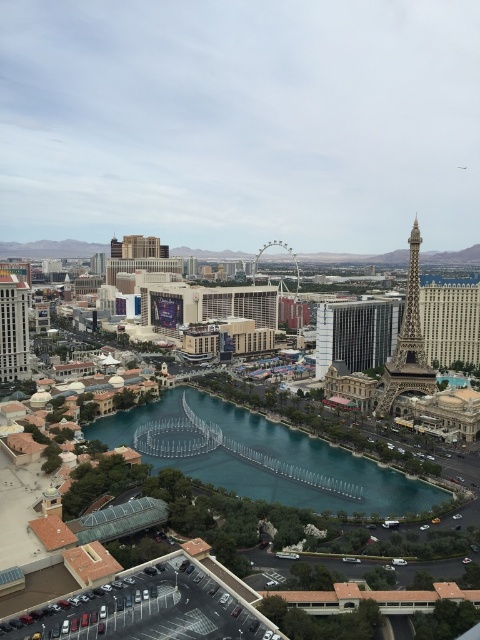
Question: Which point is farther to the camera?

Choices:
 (A) (3, 273)
 (B) (398, 481)
 (C) (297, 516)
 (D) (389, 392)

Answer: (A)

Question: Can you confirm if reflective glass fountain at center is thinner than shiny gold eiffel tower at right?

Choices:
 (A) yes
 (B) no

Answer: (B)

Question: Is reflective glass fountain at center below green glass river at center?

Choices:
 (A) yes
 (B) no

Answer: (B)

Question: Considering the real-world distances, which object is farthest from the green glass river at center?

Choices:
 (A) shiny gold eiffel tower at right
 (B) reflective glass fountain at center

Answer: (A)

Question: Based on their relative distances, which object is nearer to the shiny gold eiffel tower at right?

Choices:
 (A) green glass river at center
 (B) reflective glass fountain at center
 (C) matte silver hotel at left

Answer: (A)

Question: Can you confirm if green glass river at center is bigger than matte silver hotel at left?

Choices:
 (A) yes
 (B) no

Answer: (A)